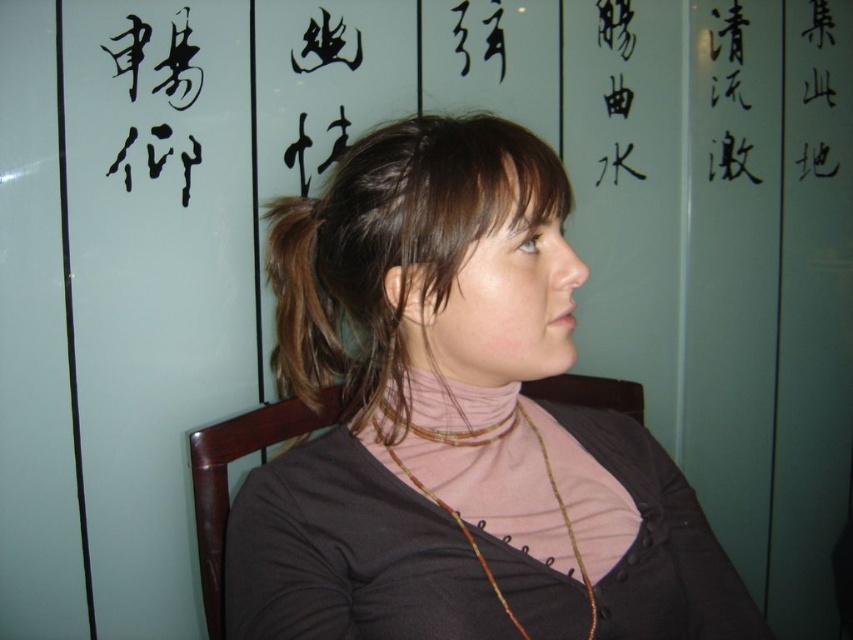
You are a photographer adjusting the lighting for a portrait. You notice two sections of hair, the matte brown hair at center and the brown shiny hair at center. Which hair section is closer to the camera?

The matte brown hair at center is closer to the camera because it is in front of the brown shiny hair at center.

You are a photographer adjusting your camera settings to capture the person in the scene. You notice two necklaces on the person. Which necklace, the multicolored beaded necklace at center or the matte gold necklace at center, appears closer to you?

The multicolored beaded necklace at center appears closer to you because it is further to the viewer than the matte gold necklace at center.

You are a photographer adjusting the camera focus. The subject has two distinct hair sections, the matte brown hair at center and the brown shiny hair at upper left. Since the camera can only focus on one section at a time, which hair section should you choose to ensure the other is still in the frame? Explain your reasoning based on their distance apart.

Both the matte brown hair at center and the brown shiny hair at upper left are only 9.86 centimeters apart. Since this distance is relatively small, focusing on either section would keep the other within the camera frame. However, focusing on the matte brown hair at center might be preferable as it is centrally located, making the composition more balanced.